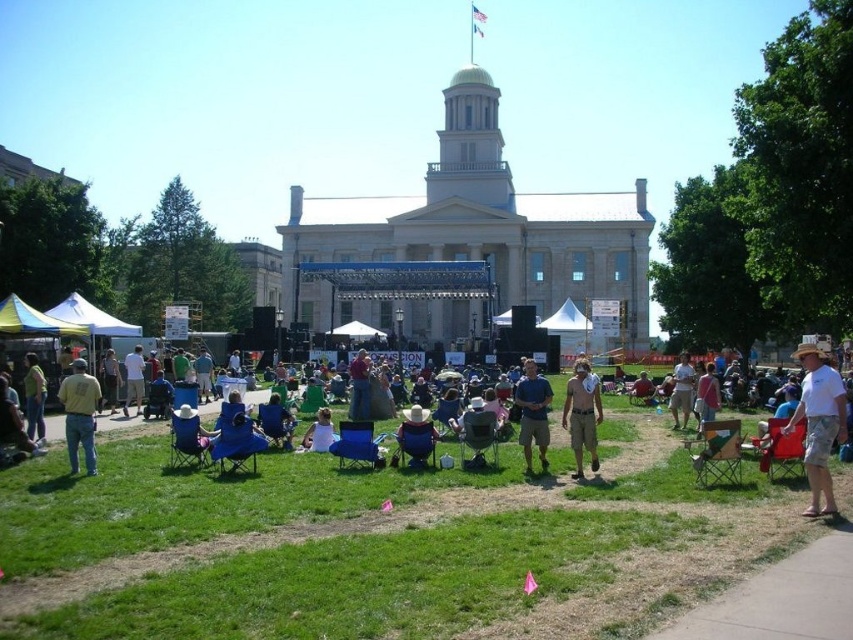
Can you confirm if light blue denim jeans at lower left is taller than light brown leather jacket at center?

Yes.

Does light blue denim jeans at lower left appear over light brown leather jacket at center?

No.

What do you see at coordinates (33, 397) in the screenshot? The image size is (853, 640). I see `light blue denim jeans at lower left` at bounding box center [33, 397].

You are a GUI agent. You are given a task and a screenshot of the screen. Output one action in this format:
    pyautogui.click(x=<x>, y=<y>)
    Task: Click on the light blue denim jeans at lower left
    Image resolution: width=853 pixels, height=640 pixels.
    Given the screenshot: What is the action you would take?
    pyautogui.click(x=33, y=397)

Which of these two, white cotton shirt at right or light blue denim shorts at center, stands shorter?

With less height is light blue denim shorts at center.

Does point (808, 472) lie behind point (142, 376)?

No, it is in front of (142, 376).

You are a GUI agent. You are given a task and a screenshot of the screen. Output one action in this format:
    pyautogui.click(x=<x>, y=<y>)
    Task: Click on the white cotton shirt at right
    Image resolution: width=853 pixels, height=640 pixels.
    Given the screenshot: What is the action you would take?
    pyautogui.click(x=819, y=422)

Is light blue denim jeans at lower left smaller than light blue denim shorts at center?

Actually, light blue denim jeans at lower left might be larger than light blue denim shorts at center.

Is light blue denim jeans at lower left behind light blue denim shorts at center?

No, light blue denim jeans at lower left is in front of light blue denim shorts at center.

Image resolution: width=853 pixels, height=640 pixels. What are the coordinates of `light blue denim jeans at lower left` in the screenshot? It's located at (33, 397).